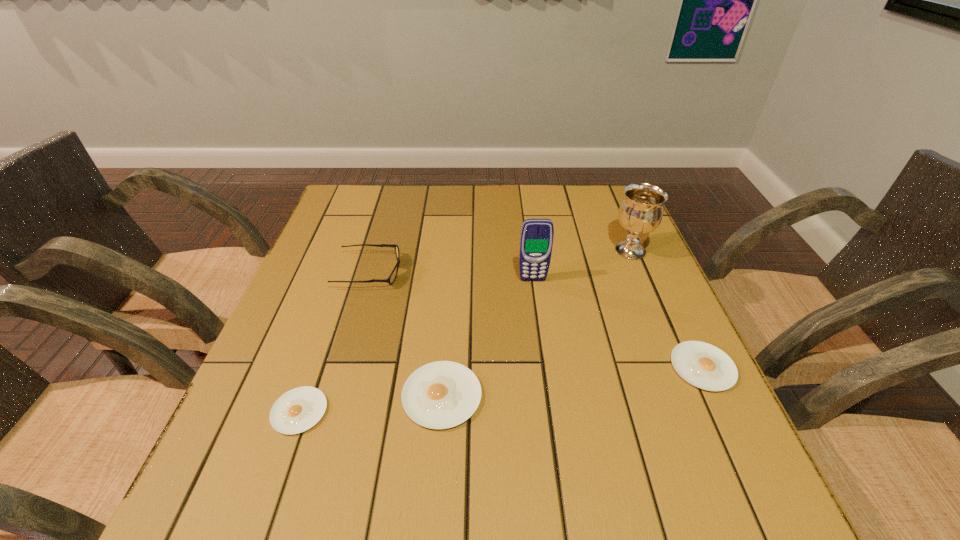
To achieve even spacing by inserting another egg_yolk among them, please point to a vacant spot for this new egg_yolk. Please provide its 2D coordinates. Your answer should be formatted as a tuple, i.e. [(x, y)], where the tuple contains the x and y coordinates of a point satisfying the conditions above.

[(576, 381)]